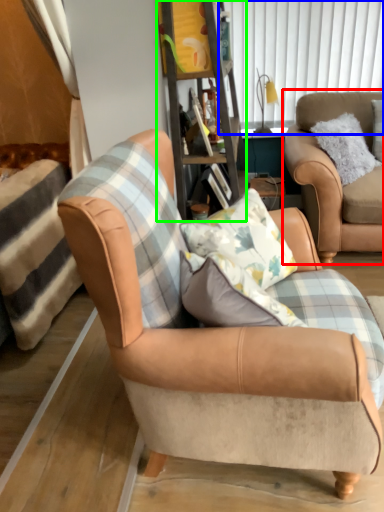
Question: Which object is positioned farthest from chair (highlighted by a red box)? Select from window screen (highlighted by a blue box) and bookshelf (highlighted by a green box).

Choices:
 (A) window screen
 (B) bookshelf

Answer: (A)